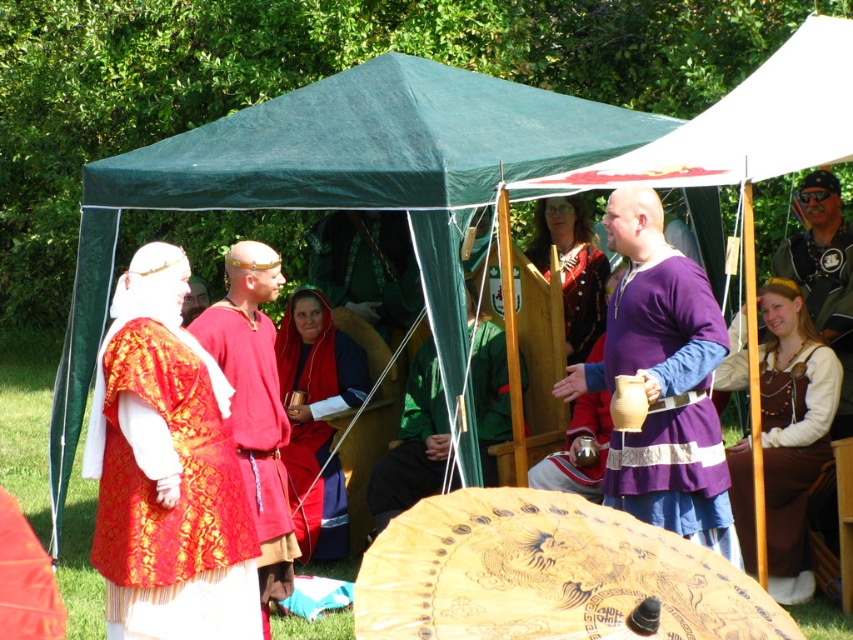
You are a photographer trying to capture a group photo of the matte gold brocade vest at left and the brown leather apron at right. The camera you are using has a maximum focus range of 10 feet. Can you fit both subjects within the camera range without moving either of them?

The distance between the matte gold brocade vest at left and the brown leather apron at right is 9.71 feet, which is within the camera maximum focus range of 10 feet. Therefore, you can fit both subjects within the camera range without moving them.

You are a costume designer observing the historical reenactment. You need to determine which costume has a taller silhouette between the red velvet tunic at center and the leather jacket at upper right. Which one is taller?

The red velvet tunic at center has a greater height compared to the leather jacket at upper right, so the red velvet tunic at center is taller.

You are a photographer positioned at the edge of the scene. You want to capture a photo that includes both the wooden carved umbrella at center and the purple fabric shirt at right. Based on their positions, which object should you adjust your camera angle to include first?

The wooden carved umbrella at center is to the left of the purple fabric shirt at right, so you should adjust your camera angle to include the wooden carved umbrella at center first as it is closer to the left side of the frame.